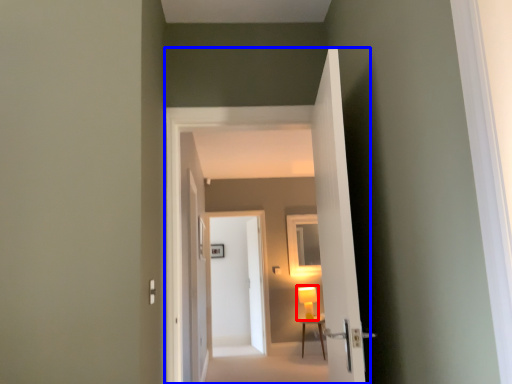
Question: Which point is closer to the camera, table lamp (highlighted by a red box) or corridor (highlighted by a blue box)?

Choices:
 (A) table lamp
 (B) corridor

Answer: (B)